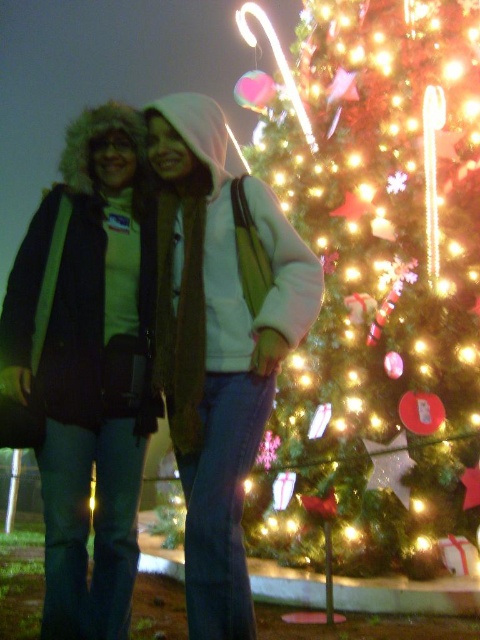
Question: Does matte black jacket at center have a lesser width compared to brushed metal jacket at left?

Choices:
 (A) no
 (B) yes

Answer: (A)

Question: Considering the relative positions of matte black jacket at center and brushed metal jacket at left in the image provided, where is matte black jacket at center located with respect to brushed metal jacket at left?

Choices:
 (A) right
 (B) left

Answer: (A)

Question: Among these points, which one is nearest to the camera?

Choices:
 (A) (436, 177)
 (B) (23, 253)
 (C) (154, 120)

Answer: (B)

Question: Among these objects, which one is farthest from the camera?

Choices:
 (A) matte black jacket at center
 (B) illuminated green at center
 (C) brushed metal jacket at left

Answer: (B)

Question: Can you confirm if illuminated green at center is bigger than brushed metal jacket at left?

Choices:
 (A) no
 (B) yes

Answer: (B)

Question: Which object appears farthest from the camera in this image?

Choices:
 (A) brushed metal jacket at left
 (B) illuminated green at center
 (C) matte black jacket at center

Answer: (B)